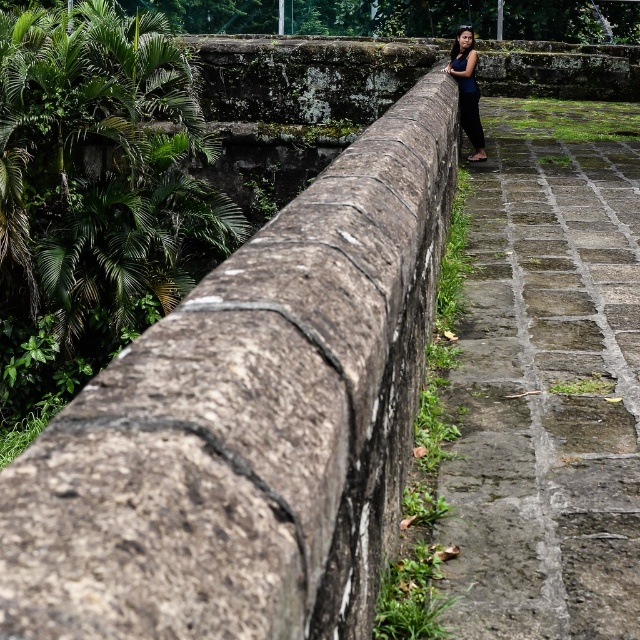
You are a gardener planning to trim the green leafy foliage at left and the green mossy stone at right. Which area requires more attention based on their size?

The green leafy foliage at left requires more attention since it occupies more space than the green mossy stone at right.

You are standing at the end of the weathered stone railing and want to walk towards the dense tropical greenery in the background. Which of the two points, point (19, 337) or point (449, 72), is closer to you as you face the railing?

Point (19, 337) is closer to you because it is further to the viewer than point (449, 72), meaning it is nearer in the scene.